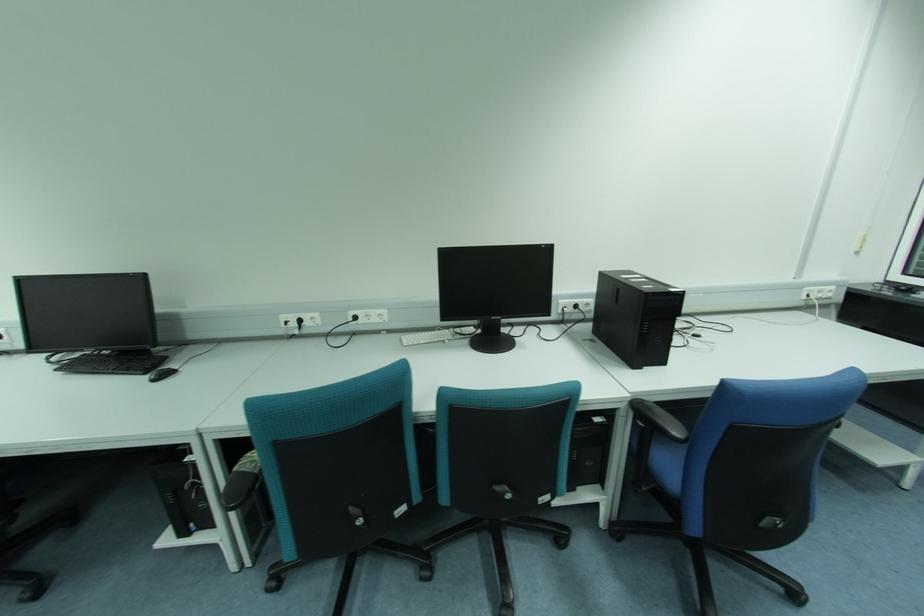
Locate an element on the screen. white computer keyboard is located at coordinates (438, 334).